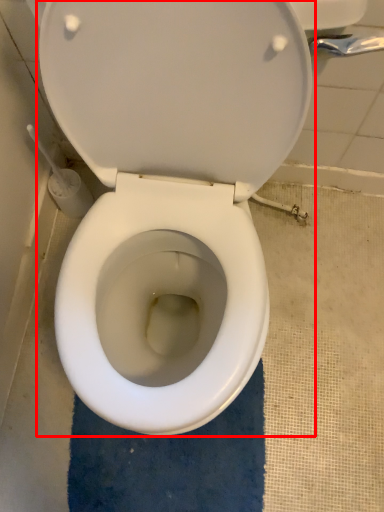
Question: From the image's perspective, where is toilet (annotated by the red box) located relative to bath mat?

Choices:
 (A) above
 (B) below

Answer: (A)